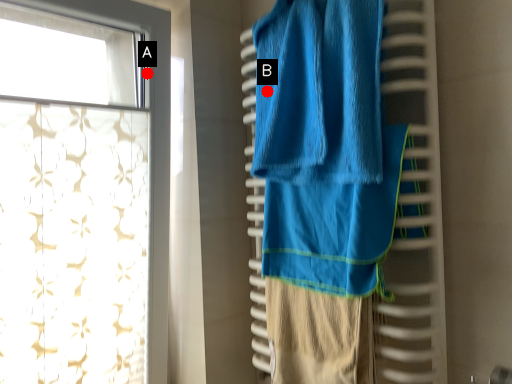
Question: Two points are circled on the image, labeled by A and B beside each circle. Which point appears farthest from the camera in this image?

Choices:
 (A) A is further
 (B) B is further

Answer: (A)